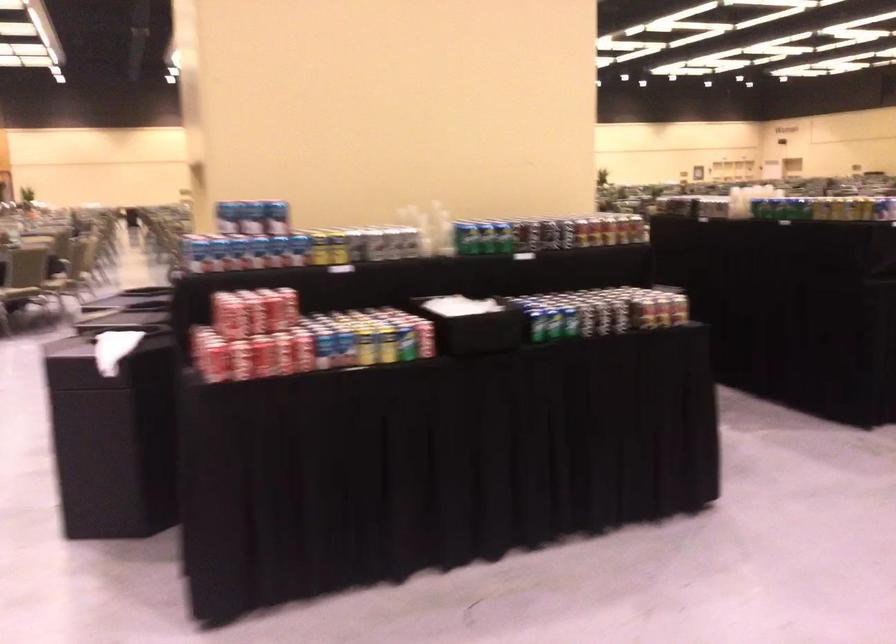
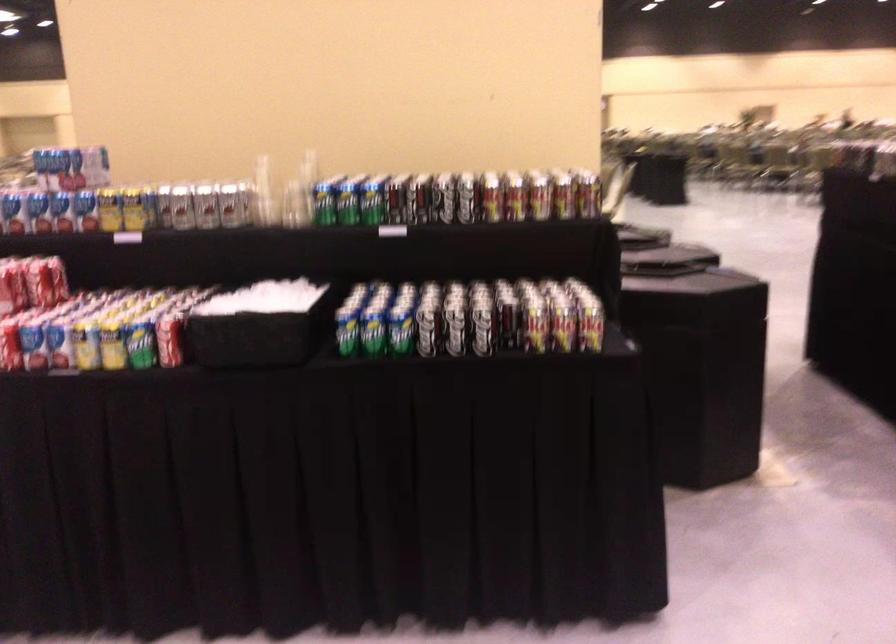
In the second image, find the point that corresponds to pixel 297 251 in the first image.

(85, 210)